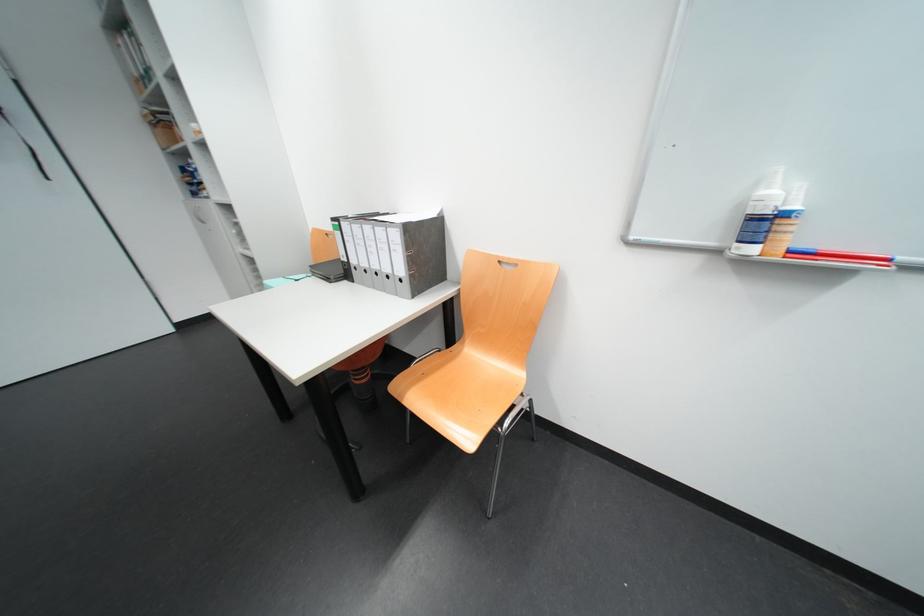
This screenshot has height=616, width=924. I want to click on chair back handle, so click(x=508, y=267).